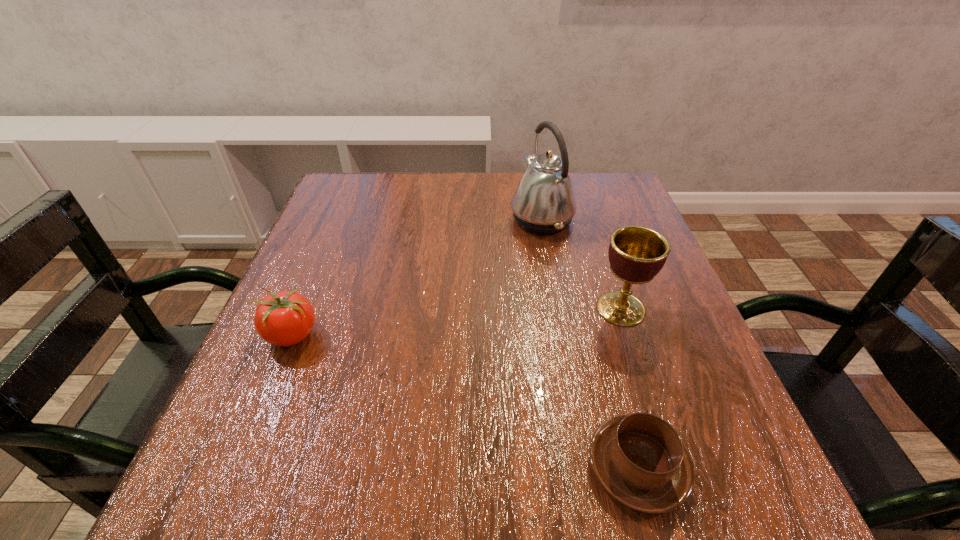
Where is `the farthest object`? The height and width of the screenshot is (540, 960). the farthest object is located at coordinates (544, 203).

At what (x,y) coordinates should I click in order to perform the action: click on the tallest object. Please return your answer as a coordinate pair (x, y). Looking at the image, I should click on (544, 203).

Where is `chalice`? This screenshot has width=960, height=540. chalice is located at coordinates (636, 254).

The image size is (960, 540). I want to click on the leftmost object, so click(286, 318).

In order to click on tomato in this screenshot , I will do `click(286, 318)`.

The height and width of the screenshot is (540, 960). Find the location of `the nearest object`. the nearest object is located at coordinates (639, 459).

Locate an element on the screen. This screenshot has height=540, width=960. the shortest object is located at coordinates (639, 459).

Where is `vacant space situated on the front of the kettle`? The width and height of the screenshot is (960, 540). vacant space situated on the front of the kettle is located at coordinates (555, 290).

Where is `blank space located 0.370m on the back of the third shortest object`? blank space located 0.370m on the back of the third shortest object is located at coordinates (584, 194).

Locate an element on the screen. vacant space located 0.190m on the back of the second shortest object is located at coordinates (325, 253).